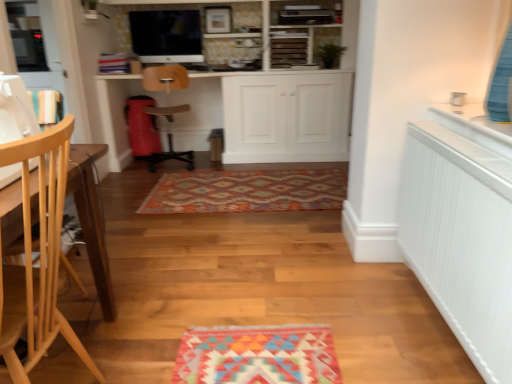
Where is `vacant area on top of satin black monitor at upper center (from a real-world perspective)`? The image size is (512, 384). vacant area on top of satin black monitor at upper center (from a real-world perspective) is located at coordinates (165, 6).